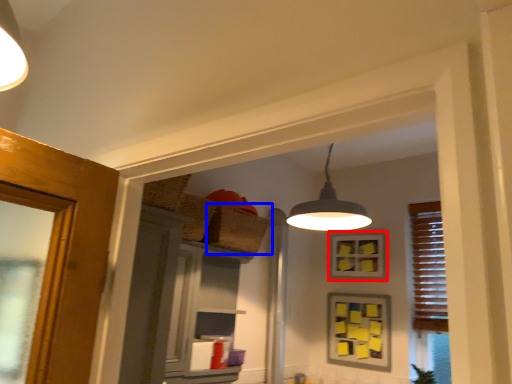
Question: Which object is closer to the camera taking this photo, picture frame (highlighted by a red box) or basket (highlighted by a blue box)?

Choices:
 (A) picture frame
 (B) basket

Answer: (B)